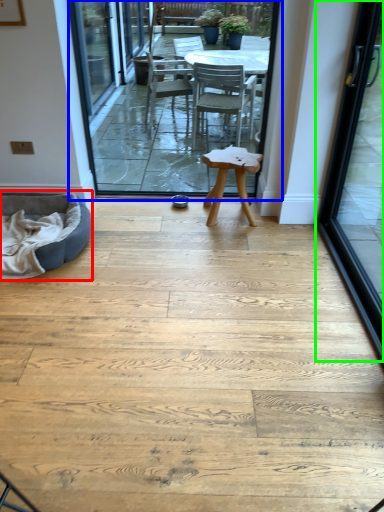
Question: Which object is positioned closest to bean bag chair (highlighted by a red box)? Select from terrace (highlighted by a blue box) and door (highlighted by a green box).

Choices:
 (A) terrace
 (B) door

Answer: (A)